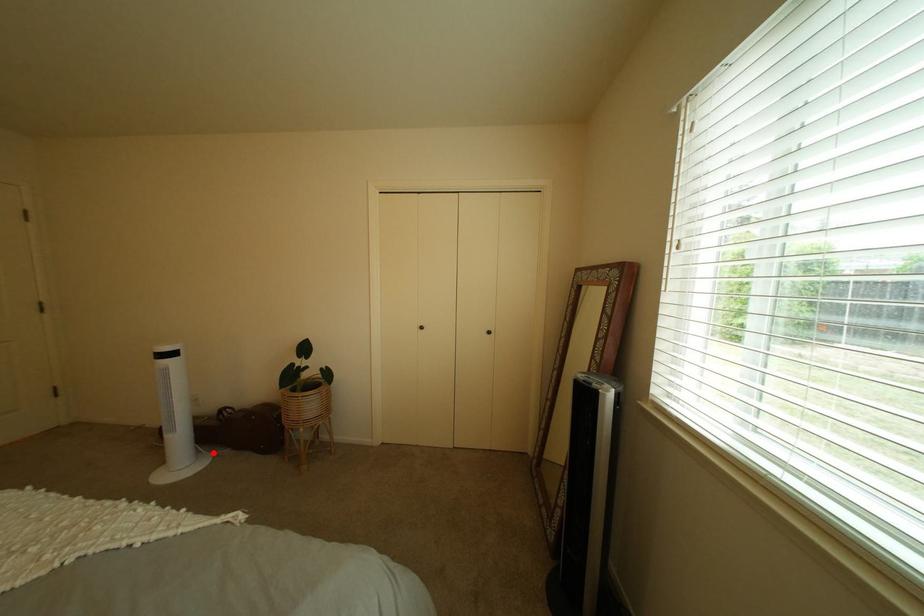
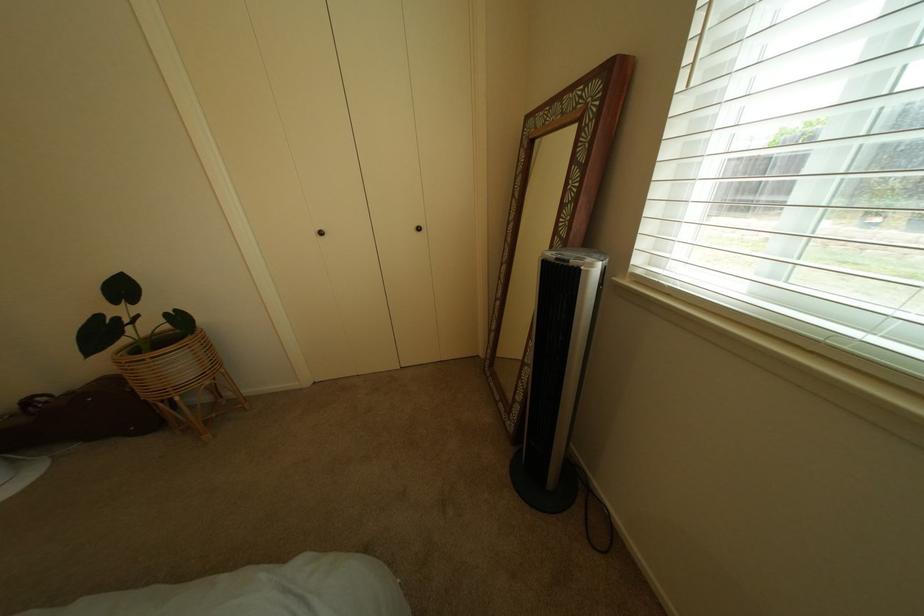
Locate, in the second image, the point that corresponds to the highlighted location in the first image.

(30, 463)